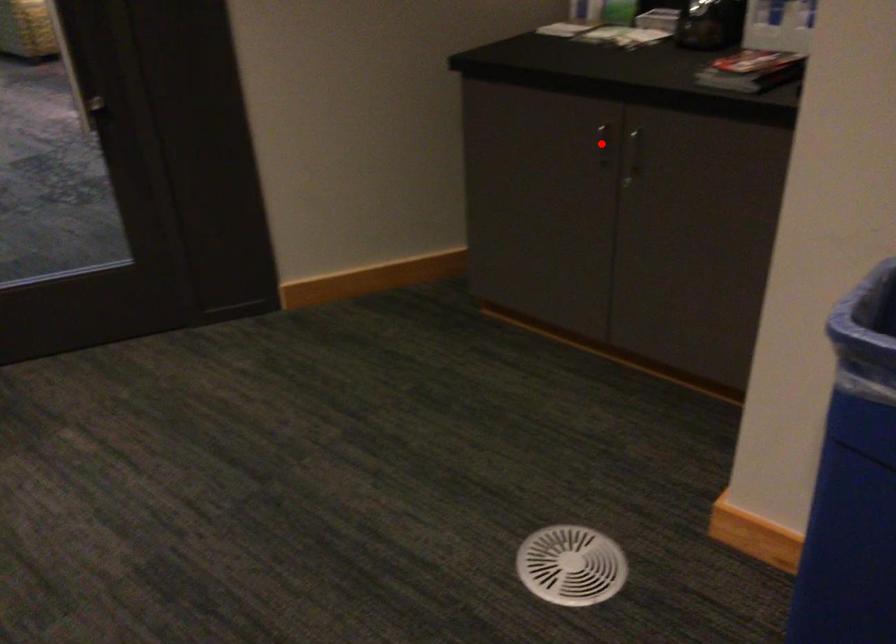
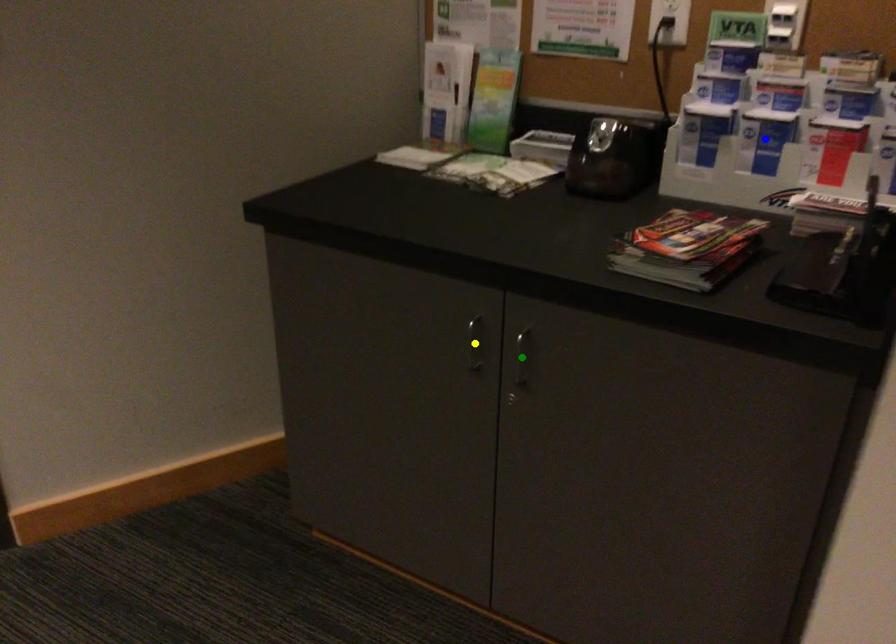
Question: I am providing you with two images of the same scene from different viewpoints. A red point is marked on the first image. You are given multiple points on the second image. Can you choose the point in image 2 that corresponds to the point in image 1?

Choices:
 (A) yellow point
 (B) green point
 (C) blue point

Answer: (A)